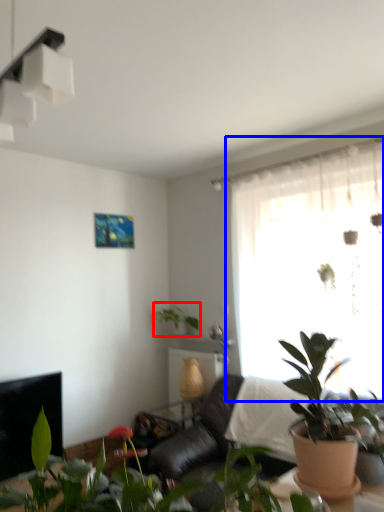
Question: Which of the following is the closest to the observer, houseplant (highlighted by a red box) or window (highlighted by a blue box)?

Choices:
 (A) houseplant
 (B) window

Answer: (B)